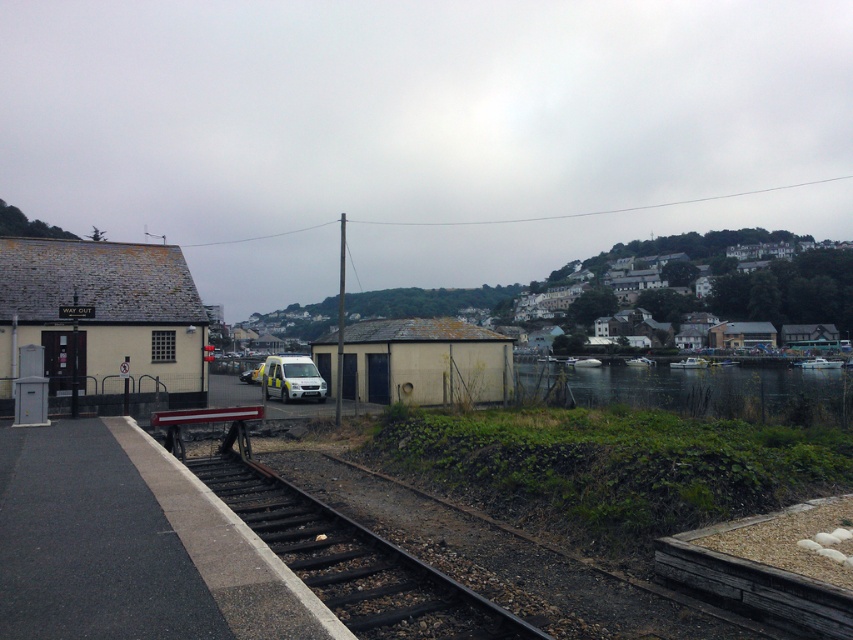
Question: Which point is farther from the camera taking this photo?

Choices:
 (A) (596, 385)
 (B) (387, 369)
 (C) (271, 516)

Answer: (A)

Question: Is green water at lower right positioned behind white matte ambulance at center?

Choices:
 (A) yes
 (B) no

Answer: (B)

Question: Among these objects, which one is nearest to the camera?

Choices:
 (A) black metal train track at lower center
 (B) white matte ambulance at center
 (C) matte yellow building at left
 (D) green water at lower right

Answer: (A)

Question: Is black metal train track at lower center smaller than green water at lower right?

Choices:
 (A) no
 (B) yes

Answer: (B)

Question: Can you confirm if matte yellow building at left is wider than white matte ambulance at center?

Choices:
 (A) no
 (B) yes

Answer: (B)

Question: Which object is the farthest from the white corrugated metal shed at center?

Choices:
 (A) matte yellow building at left
 (B) white matte ambulance at center
 (C) black metal train track at lower center
 (D) green water at lower right

Answer: (D)